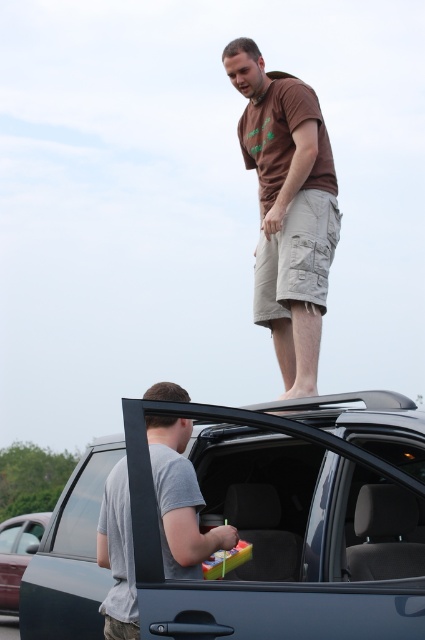
Can you confirm if brown cotton t-shirt at upper center is shorter than gray matte plastic bag at center?

No, brown cotton t-shirt at upper center is not shorter than gray matte plastic bag at center.

Does brown cotton t-shirt at upper center appear under gray matte plastic bag at center?

Actually, brown cotton t-shirt at upper center is above gray matte plastic bag at center.

Who is more distant from viewer, (302,216) or (104,504)?

The point (302,216) is more distant.

Find the location of `brown cotton t-shirt at upper center`. brown cotton t-shirt at upper center is located at coordinates (288, 209).

Who is lower down, matte gray suv at center or metallic gray car door at lower left?

metallic gray car door at lower left

Can you confirm if matte gray suv at center is positioned above metallic gray car door at lower left?

Indeed, matte gray suv at center is positioned over metallic gray car door at lower left.

Is point (339, 538) farther from camera compared to point (11, 580)?

No.

Locate an element on the screen. matte gray suv at center is located at coordinates (254, 528).

The height and width of the screenshot is (640, 425). Find the location of `brown cotton t-shirt at upper center`. brown cotton t-shirt at upper center is located at coordinates (288, 209).

Is brown cotton t-shirt at upper center smaller than metallic gray car door at lower left?

Correct, brown cotton t-shirt at upper center occupies less space than metallic gray car door at lower left.

Is point (302, 381) closer to camera compared to point (5, 564)?

Yes, point (302, 381) is closer to viewer.

The height and width of the screenshot is (640, 425). In order to click on brown cotton t-shirt at upper center in this screenshot , I will do `click(288, 209)`.